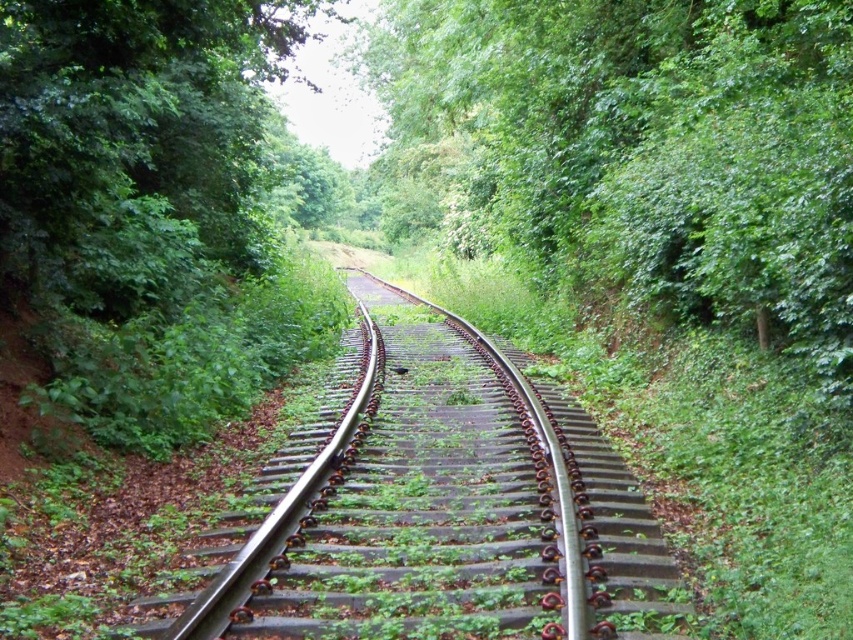
Who is taller, green leafy tree at center or metal/smooth track at center?

green leafy tree at center

Between green leafy tree at center and metal/smooth track at center, which one is positioned higher?

green leafy tree at center is higher up.

This screenshot has height=640, width=853. I want to click on green leafy tree at center, so click(641, 150).